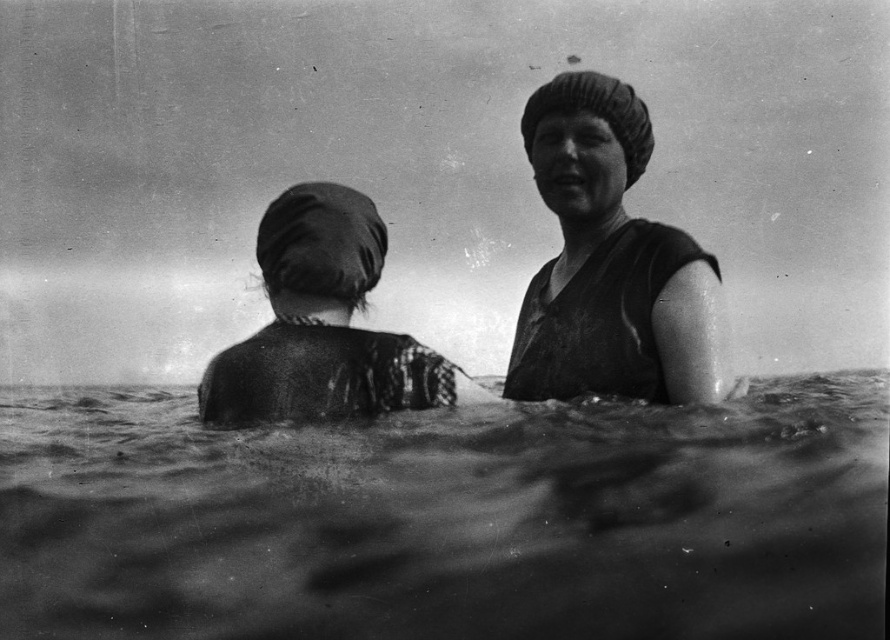
Who is shorter, rough textured water at center or smooth fabric swim cap at upper right?

rough textured water at center is shorter.

Who is higher up, rough textured water at center or smooth fabric swim cap at upper right?

smooth fabric swim cap at upper right is above.

Describe the element at coordinates (447, 520) in the screenshot. I see `rough textured water at center` at that location.

Find the location of a particular element. The image size is (890, 640). rough textured water at center is located at coordinates (447, 520).

Can you confirm if rough textured water at center is positioned to the right of dark fabric headscarf at left?

In fact, rough textured water at center is to the left of dark fabric headscarf at left.

Between rough textured water at center and dark fabric headscarf at left, which one has less height?

Standing shorter between the two is rough textured water at center.

Who is more forward, (119, 390) or (318, 358)?

Positioned in front is point (318, 358).

This screenshot has width=890, height=640. In order to click on rough textured water at center in this screenshot , I will do `click(447, 520)`.

Between smooth fabric swim cap at upper right and dark fabric headscarf at left, which one appears on the left side from the viewer's perspective?

dark fabric headscarf at left is more to the left.

Based on the photo, is smooth fabric swim cap at upper right bigger than dark fabric headscarf at left?

Correct, smooth fabric swim cap at upper right is larger in size than dark fabric headscarf at left.

Where is `smooth fabric swim cap at upper right`? smooth fabric swim cap at upper right is located at coordinates (607, 260).